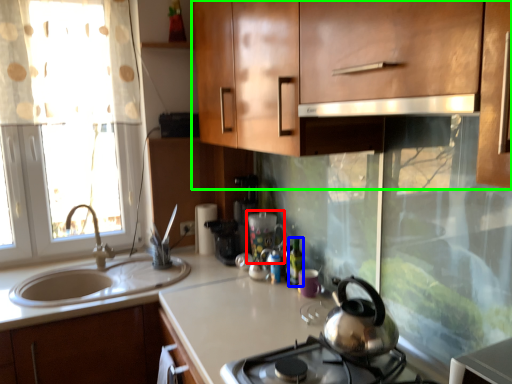
Question: Which object is the closest to the appliance (highlighted by a red box)? Choose among these: bottle (highlighted by a blue box) or cabinetry (highlighted by a green box).

Choices:
 (A) bottle
 (B) cabinetry

Answer: (A)